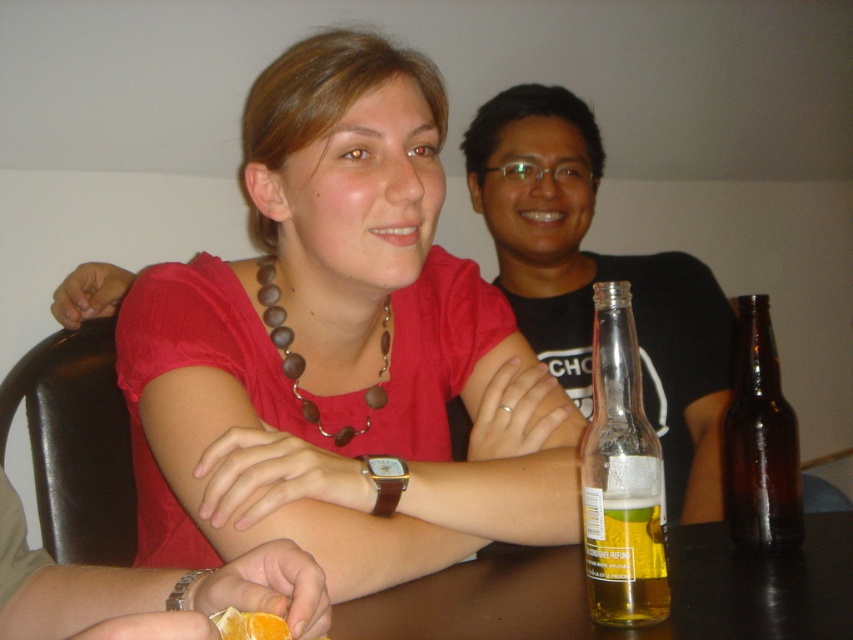
What is located at the coordinates point (621, 476)?

Answer: The clear glass bottle at center is located at point (621, 476).

You are standing in the room and want to place a new decorative item on the brown wooden table at lower center. What are the coordinates where you should place it?

The coordinates for the brown wooden table at lower center are at point (624, 628).